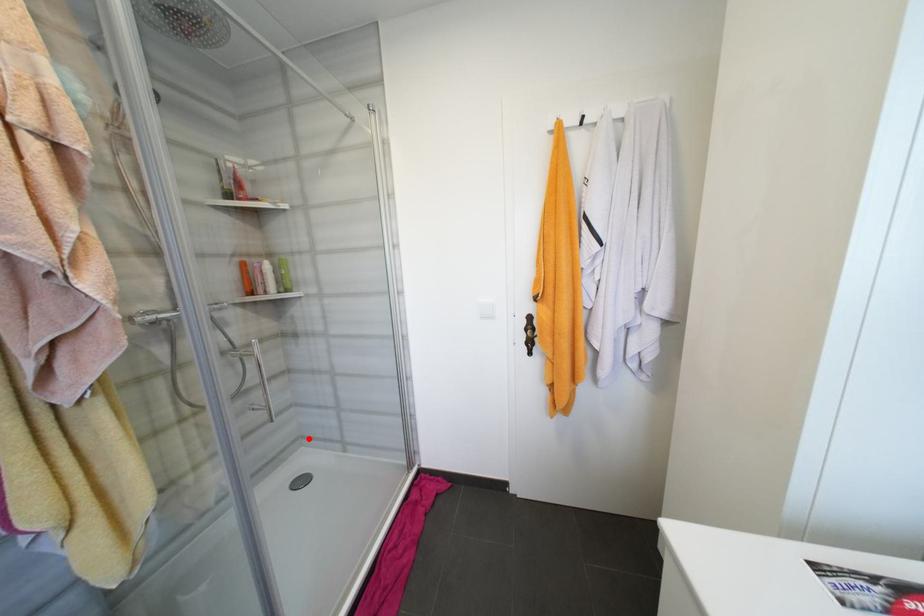
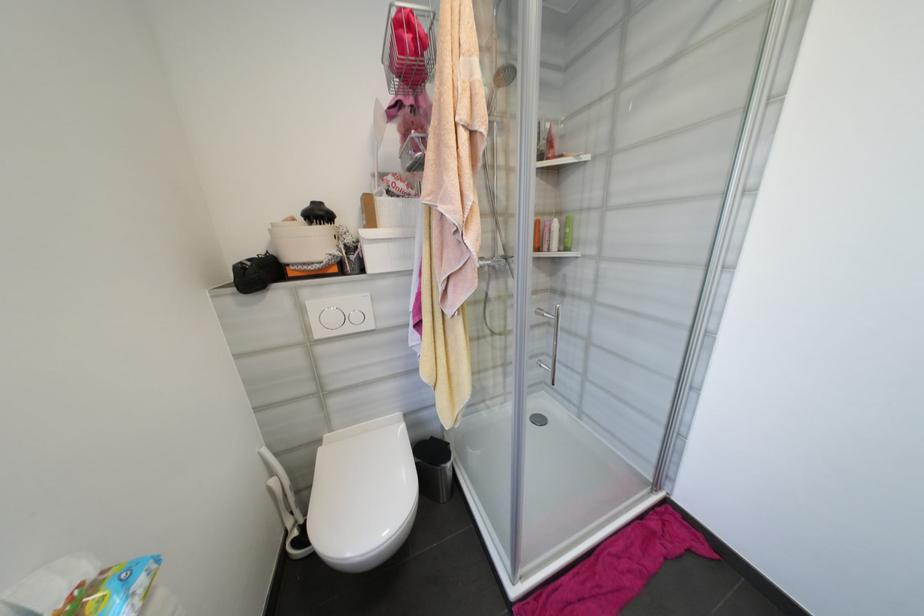
The point at the highlighted location is marked in the first image. Where is the corresponding point in the second image?

(552, 384)